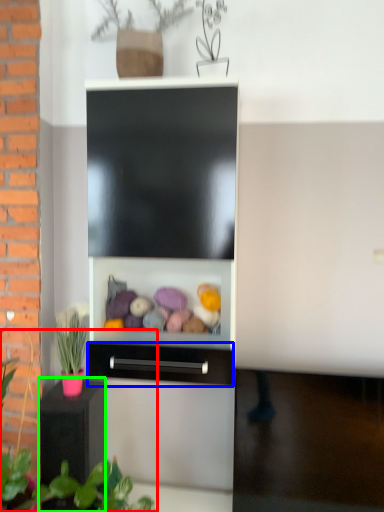
Question: Which is farther away from plant (highlighted by a red box)? drawer (highlighted by a blue box) or furniture (highlighted by a green box)?

Choices:
 (A) drawer
 (B) furniture

Answer: (A)